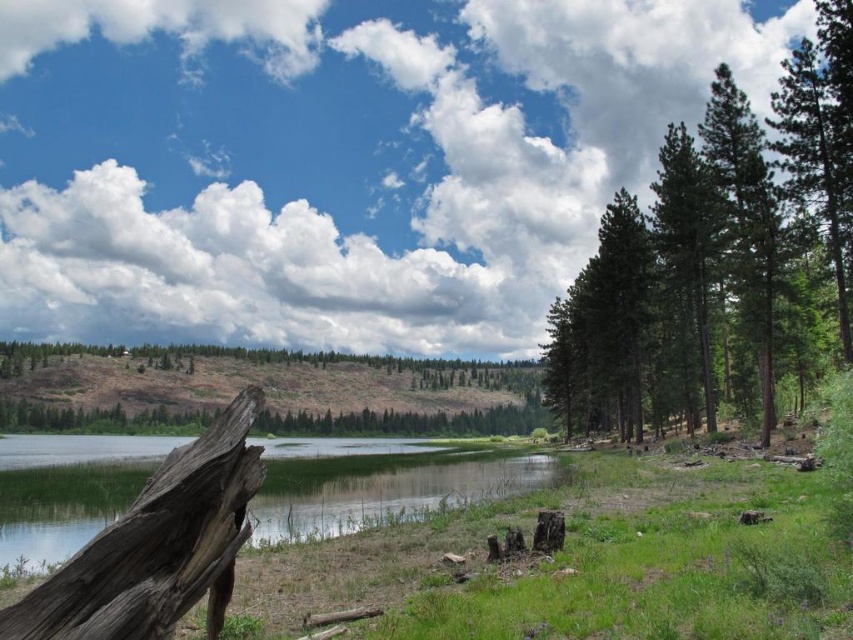
Which is behind, point (822, 212) or point (99, 516)?

Point (822, 212)

The height and width of the screenshot is (640, 853). What do you see at coordinates (717, 252) in the screenshot?
I see `green textured pine trees at right` at bounding box center [717, 252].

Which is in front, point (642, 340) or point (282, 449)?

Positioned in front is point (642, 340).

This screenshot has height=640, width=853. In order to click on green textured pine trees at right in this screenshot , I will do `click(717, 252)`.